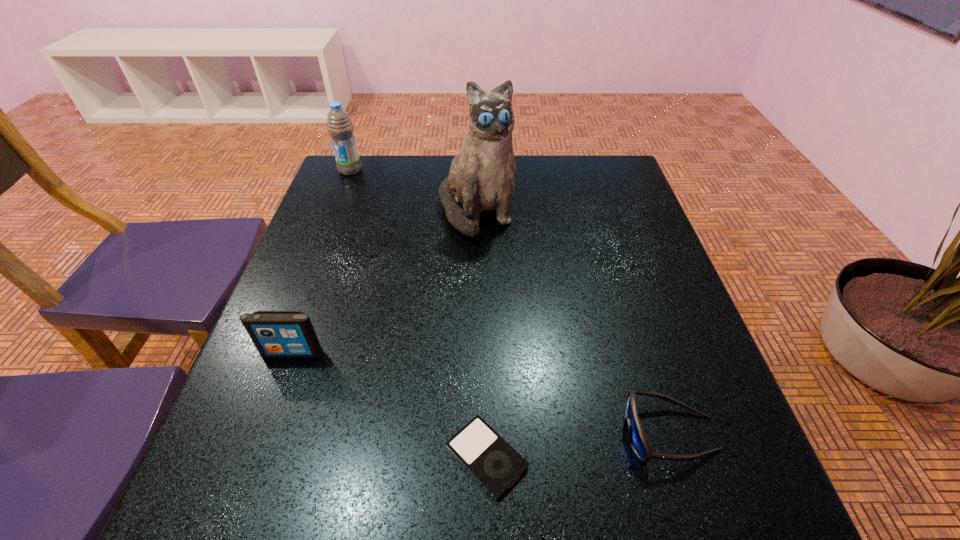
I want to click on water bottle located in the left edge section of the desktop, so click(x=339, y=125).

At what (x,y) coordinates should I click in order to perform the action: click on iPod present at the left edge. Please return your answer as a coordinate pair (x, y). The width and height of the screenshot is (960, 540). Looking at the image, I should click on (276, 334).

The height and width of the screenshot is (540, 960). I want to click on object that is positioned at the right edge, so click(x=638, y=440).

Locate an element on the screen. This screenshot has width=960, height=540. object that is at the far left corner is located at coordinates [x=339, y=125].

Where is `free space at the far edge of the desktop`? The image size is (960, 540). free space at the far edge of the desktop is located at coordinates (428, 162).

Where is `vacant space at the near edge of the desktop`? vacant space at the near edge of the desktop is located at coordinates (639, 492).

Image resolution: width=960 pixels, height=540 pixels. In order to click on free region at the left edge of the desktop in this screenshot , I will do `click(354, 305)`.

Image resolution: width=960 pixels, height=540 pixels. In order to click on vacant position at the right edge of the desktop in this screenshot , I will do `click(618, 218)`.

In the image, there is a desktop. In order to click on vacant space at the far left corner in this screenshot , I will do `click(385, 166)`.

Locate an element on the screen. vacant area at the far right corner is located at coordinates (596, 180).